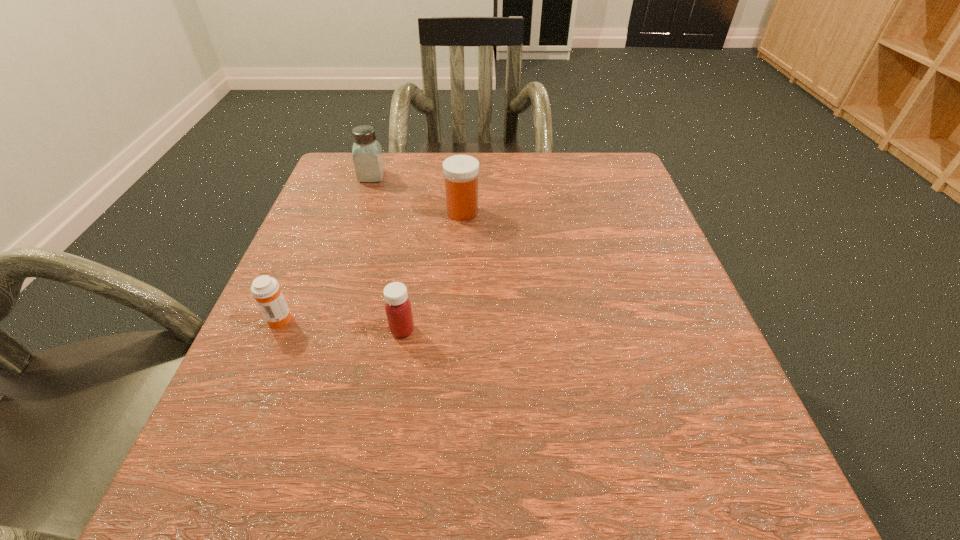
Where is `free area in between the second medicine from left to right and the rightmost medicine`? The width and height of the screenshot is (960, 540). free area in between the second medicine from left to right and the rightmost medicine is located at coordinates (432, 271).

Locate which object ranks third in proximity to the leftmost object. Please provide its 2D coordinates. Your answer should be formatted as a tuple, i.e. [(x, y)], where the tuple contains the x and y coordinates of a point satisfying the conditions above.

[(368, 160)]

Identify the location of object that is the closest to the saltshaker. (461, 172).

Where is `medicine that stands as the second closest to the farthest medicine`? medicine that stands as the second closest to the farthest medicine is located at coordinates (265, 289).

Identify the location of medicine that is the second nearest to the third object from right to left. The height and width of the screenshot is (540, 960). (265, 289).

The height and width of the screenshot is (540, 960). In order to click on vacant space that satisfies the following two spatial constraints: 1. on the back side of the saltshaker; 2. on the right side of the leftmost object in this screenshot , I will do click(340, 176).

Image resolution: width=960 pixels, height=540 pixels. I want to click on free spot that satisfies the following two spatial constraints: 1. on the front side of the third object from left to right; 2. on the left side of the saltshaker, so click(321, 330).

Find the location of a particular element. This screenshot has width=960, height=540. vacant space that satisfies the following two spatial constraints: 1. on the back side of the leftmost medicine; 2. on the right side of the second object from left to right is located at coordinates coord(340,176).